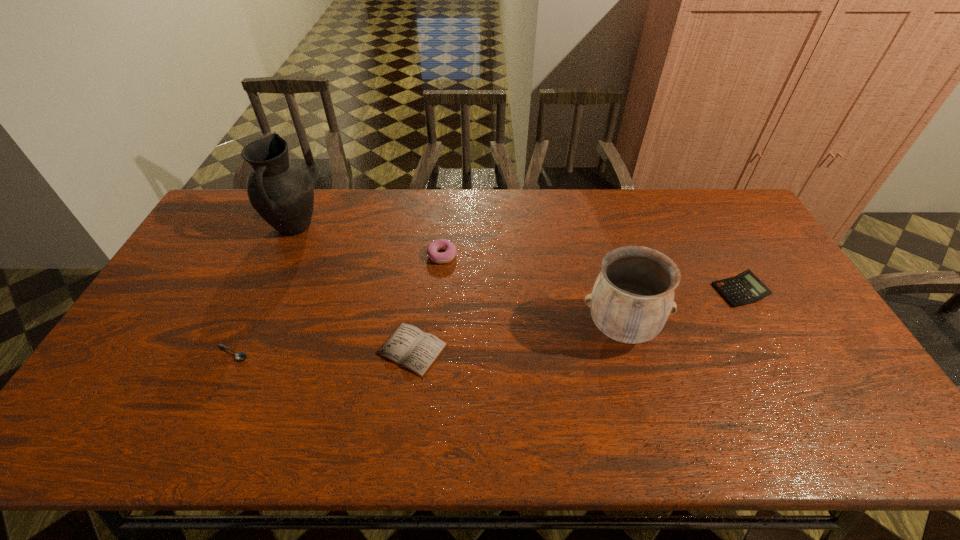
In order to click on the tallest object in this screenshot , I will do `click(282, 193)`.

Find the location of `urn`. urn is located at coordinates (632, 298).

This screenshot has height=540, width=960. Find the location of `the second object from right to left`. the second object from right to left is located at coordinates (632, 298).

In order to click on pastry in this screenshot , I will do `click(441, 244)`.

The image size is (960, 540). I want to click on calculator, so click(745, 288).

At what (x,y) coordinates should I click in order to perform the action: click on diary. Please return your answer as a coordinate pair (x, y). The width and height of the screenshot is (960, 540). Looking at the image, I should click on (409, 347).

Identify the location of the shortest object. (239, 355).

This screenshot has height=540, width=960. In order to click on free region located on the side of the tallest object with the handle in this screenshot , I will do `click(240, 345)`.

Find the location of `vacant space situated on the right of the urn`. vacant space situated on the right of the urn is located at coordinates (760, 329).

The width and height of the screenshot is (960, 540). What are the coordinates of `vacant space located on the back of the pastry` in the screenshot? It's located at pos(444,224).